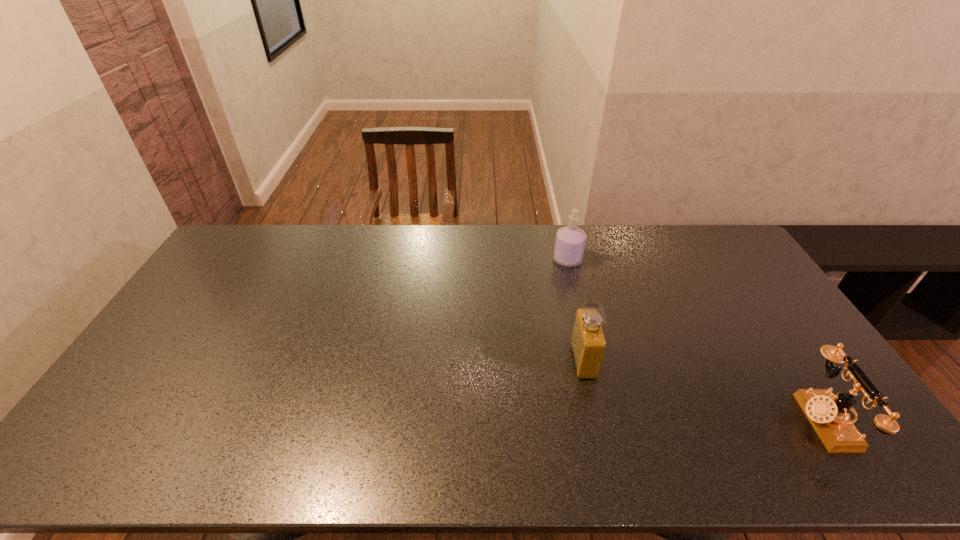
At what (x,y) coordinates should I click in order to perform the action: click on the farther perfume. Please return your answer as a coordinate pair (x, y). The width and height of the screenshot is (960, 540). Looking at the image, I should click on (570, 241).

Find the location of a particular element. the nearer perfume is located at coordinates (588, 343).

Locate an element on the screen. The width and height of the screenshot is (960, 540). the rightmost object is located at coordinates (829, 415).

The image size is (960, 540). Identify the location of free space located on the right of the farthest object. 604,260.

Image resolution: width=960 pixels, height=540 pixels. Find the location of `free point located 0.250m on the front-facing side of the nearer perfume`. free point located 0.250m on the front-facing side of the nearer perfume is located at coordinates (486, 361).

At what (x,y) coordinates should I click in order to perform the action: click on vacant space positioned 0.170m on the front-facing side of the nearer perfume. Please return your answer as a coordinate pair (x, y). Looking at the image, I should click on (514, 361).

Identify the location of free space located 0.390m on the front-facing side of the nearer perfume. The image size is (960, 540). [x=437, y=361].

Where is `free spot located 0.400m on the dial of the rightmost object`? Image resolution: width=960 pixels, height=540 pixels. free spot located 0.400m on the dial of the rightmost object is located at coordinates (644, 420).

At what (x,y) coordinates should I click in order to perform the action: click on free region located on the dial of the rightmost object. Please return your answer as a coordinate pair (x, y). This screenshot has height=540, width=960. Looking at the image, I should click on (766, 420).

The width and height of the screenshot is (960, 540). I want to click on free space located on the dial of the rightmost object, so click(x=703, y=420).